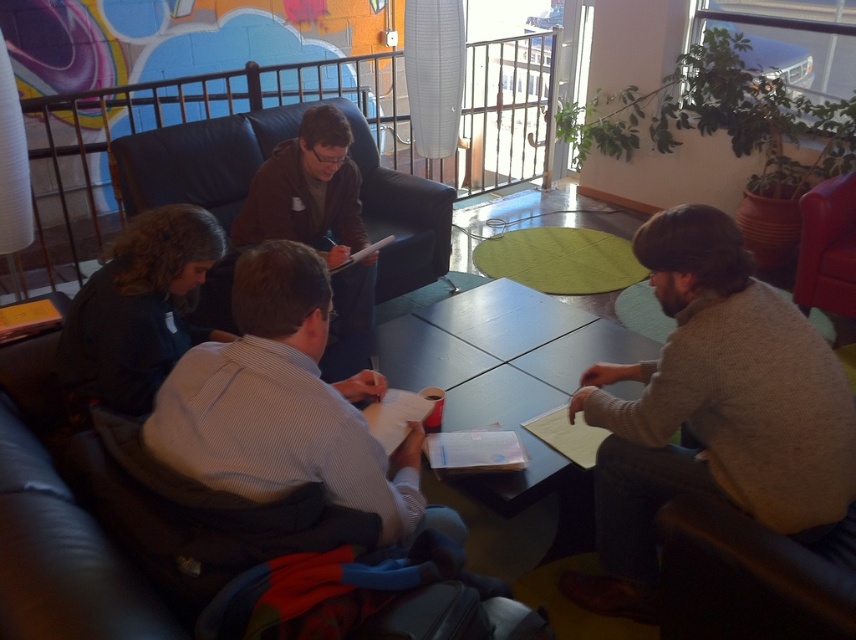
Between point (563, 502) and point (691, 556), which one is positioned behind?

Point (563, 502)

Does smooth dark wood table at center have a lesser width compared to black leather armchair at lower right?

In fact, smooth dark wood table at center might be wider than black leather armchair at lower right.

Which is behind, point (583, 531) or point (776, 561)?

The point (583, 531) is behind.

The image size is (856, 640). Identify the location of smooth dark wood table at center. (507, 410).

Between smooth dark wood table at center and dark brown leather jacket at center, which one is positioned lower?

smooth dark wood table at center is lower down.

Is smooth dark wood table at center smaller than dark brown leather jacket at center?

Incorrect, smooth dark wood table at center is not smaller in size than dark brown leather jacket at center.

You are a GUI agent. You are given a task and a screenshot of the screen. Output one action in this format:
    pyautogui.click(x=<x>, y=<y>)
    Task: Click on the smooth dark wood table at center
    Image resolution: width=856 pixels, height=640 pixels.
    Given the screenshot: What is the action you would take?
    tap(507, 410)

The width and height of the screenshot is (856, 640). Identify the location of smooth dark wood table at center. (507, 410).

Can you confirm if black leather armchair at lower right is positioned to the right of dark brown leather jacket at center?

Indeed, black leather armchair at lower right is positioned on the right side of dark brown leather jacket at center.

At what (x,y) coordinates should I click in order to perform the action: click on black leather armchair at lower right. Please return your answer as a coordinate pair (x, y). Looking at the image, I should click on (752, 577).

Is point (842, 605) positioned behind point (308, 232)?

No.

Where is `black leather armchair at lower right`? The image size is (856, 640). black leather armchair at lower right is located at coordinates (752, 577).